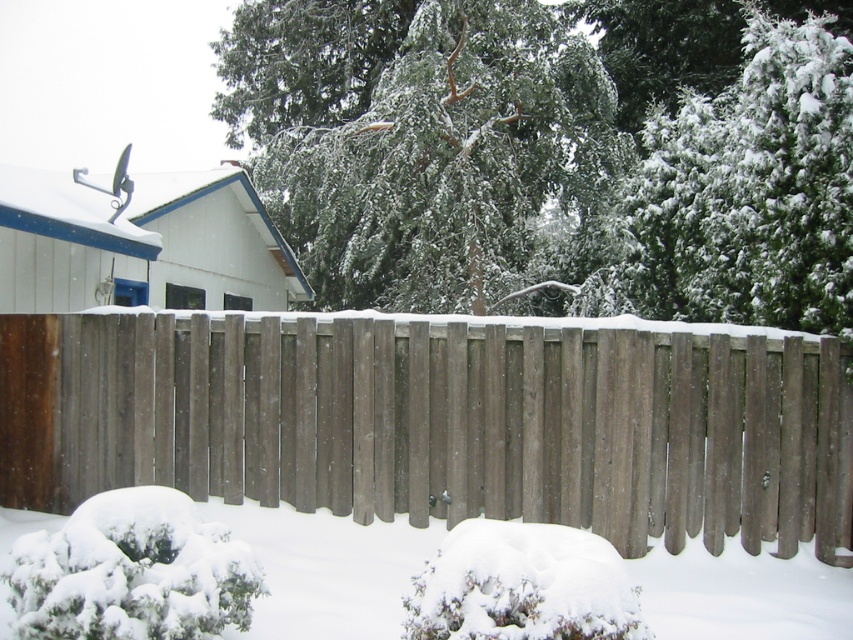
Question: Which point is farther to the camera?

Choices:
 (A) green textured tree at upper center
 (B) brown wood fence at center

Answer: (A)

Question: Which point is farther to the camera?

Choices:
 (A) white fluffy snow at center
 (B) green textured tree at upper center
 (C) brown wood fence at center

Answer: (B)

Question: Which point is farther to the camera?

Choices:
 (A) white fluffy snow at center
 (B) brown wood fence at center

Answer: (B)

Question: Is brown wood fence at center positioned at the back of white fluffy snow at center?

Choices:
 (A) no
 (B) yes

Answer: (B)

Question: Is brown wood fence at center positioned behind white fluffy snow at center?

Choices:
 (A) yes
 (B) no

Answer: (A)

Question: Does brown wood fence at center appear over white fluffy snow at center?

Choices:
 (A) yes
 (B) no

Answer: (A)